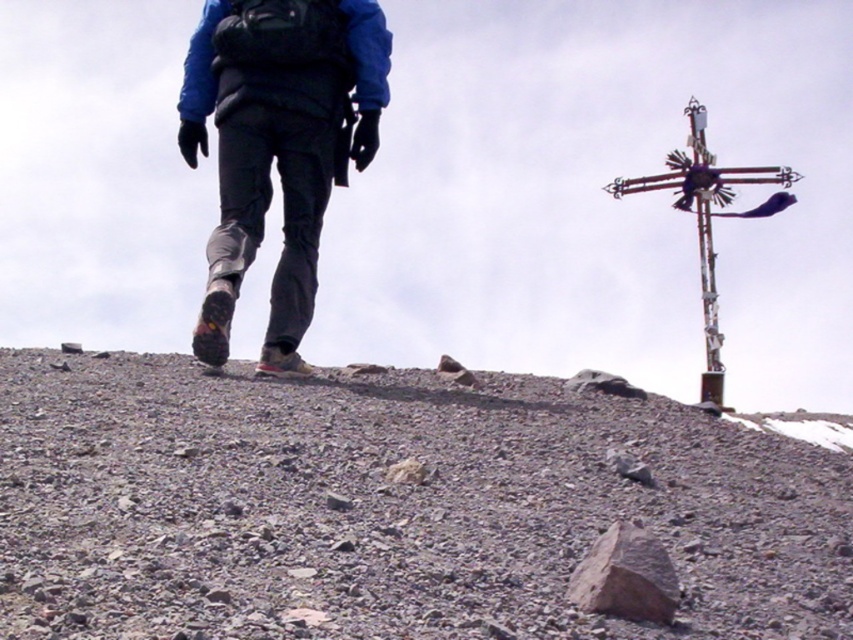
Does point (778, 192) come in front of point (651, 579)?

No, (778, 192) is further to viewer.

Who is higher up, rusty metal cross at upper right or brown rough rock at lower center?

rusty metal cross at upper right is above.

Is point (697, 179) positioned in front of point (576, 589)?

No, it is behind (576, 589).

Image resolution: width=853 pixels, height=640 pixels. I want to click on rusty metal cross at upper right, so click(708, 220).

Is gray gravel at upper center closer to camera compared to matte black pants at center?

Yes, it is.

Between gray gravel at upper center and matte black pants at center, which one has more height?

Standing taller between the two is matte black pants at center.

Is point (439, 456) more distant than point (285, 99)?

No, it is in front of (285, 99).

Where is `gray gravel at upper center`? The height and width of the screenshot is (640, 853). gray gravel at upper center is located at coordinates (389, 506).

Who is more distant from viewer, (247, 100) or (616, 588)?

The point (247, 100) is behind.

Is matte black pants at center shorter than brown rough rock at lower center?

Result: No.

What do you see at coordinates (277, 145) in the screenshot? I see `matte black pants at center` at bounding box center [277, 145].

Locate an element on the screen. This screenshot has height=640, width=853. matte black pants at center is located at coordinates (277, 145).